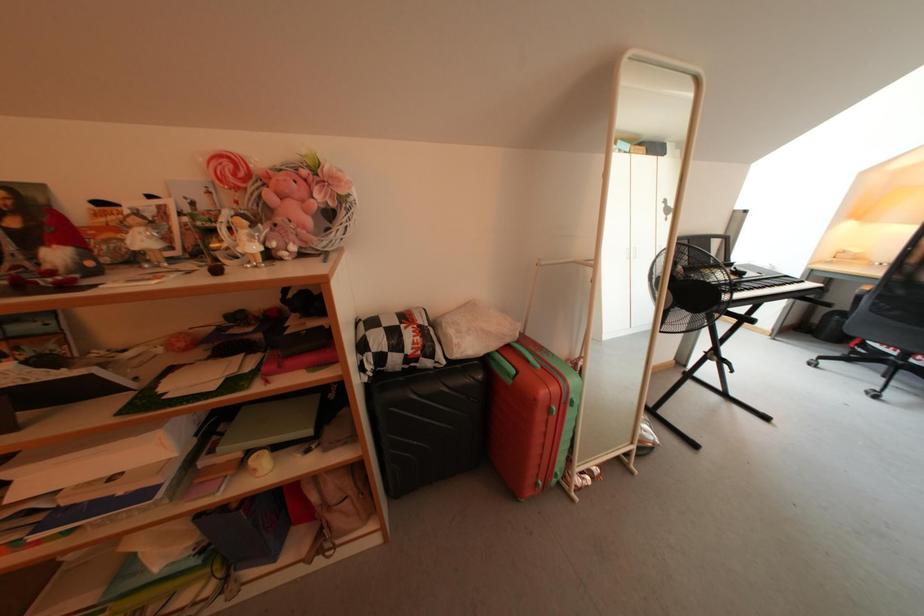
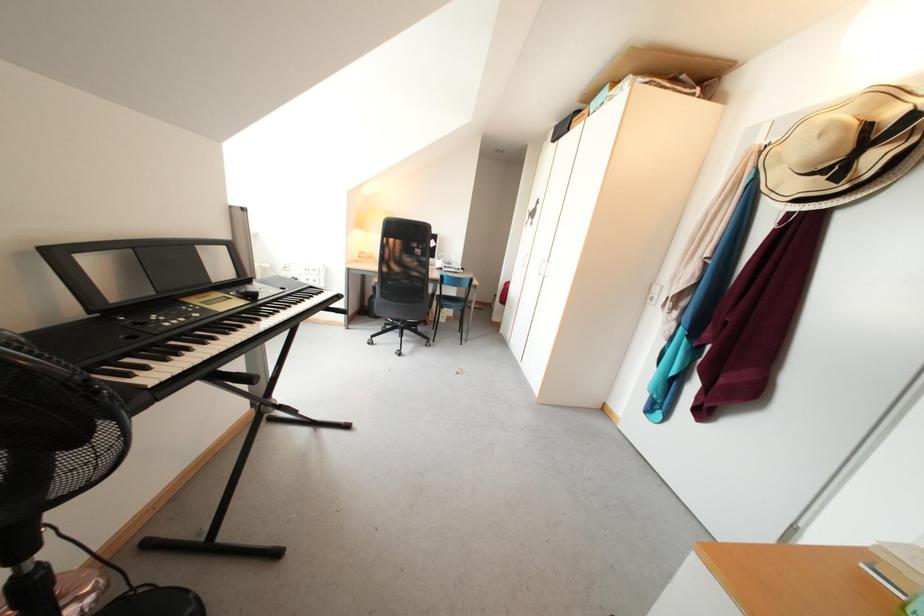
Question: The images are taken continuously from a first-person perspective. In which direction is your viewpoint rotating?

Choices:
 (A) Left
 (B) Right
 (C) Up
 (D) Down

Answer: (B)